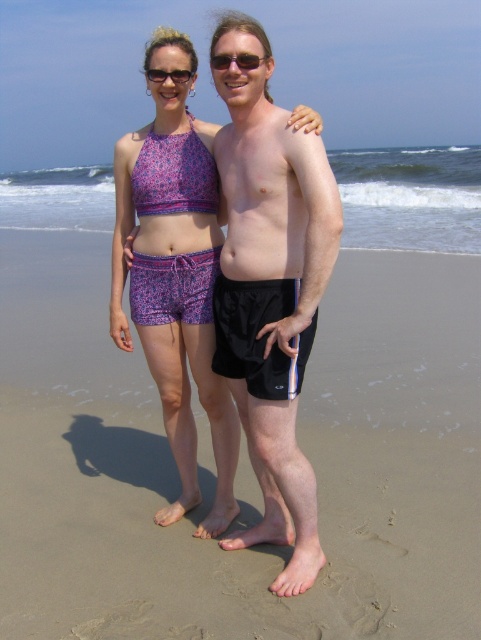
Does sandy at center appear on the right side of black matte shorts at center?

In fact, sandy at center is to the left of black matte shorts at center.

Who is taller, sandy at center or black matte shorts at center?

Standing taller between the two is black matte shorts at center.

Is point (41, 625) positioned in front of point (256, 248)?

Yes.

You are a GUI agent. You are given a task and a screenshot of the screen. Output one action in this format:
    pyautogui.click(x=<x>, y=<y>)
    Task: Click on the sandy at center
    Image resolution: width=481 pixels, height=640 pixels.
    Given the screenshot: What is the action you would take?
    pyautogui.click(x=213, y=465)

Between sandy at center and black plastic sunglasses at upper center, which one is positioned higher?

Positioned higher is black plastic sunglasses at upper center.

Does point (104, 538) lie in front of point (157, 76)?

No, (104, 538) is further to viewer.

Locate an element on the screen. sandy at center is located at coordinates (213, 465).

Between black matte shorts at center and black plastic sunglasses at upper center, which one is positioned lower?

black matte shorts at center is below.

Does black matte shorts at center come behind black plastic sunglasses at upper center?

That is False.

Between point (251, 541) and point (154, 72), which one is positioned in front?

Point (154, 72) is more forward.

Where is `black matte shorts at center`? The image size is (481, 640). black matte shorts at center is located at coordinates (273, 301).